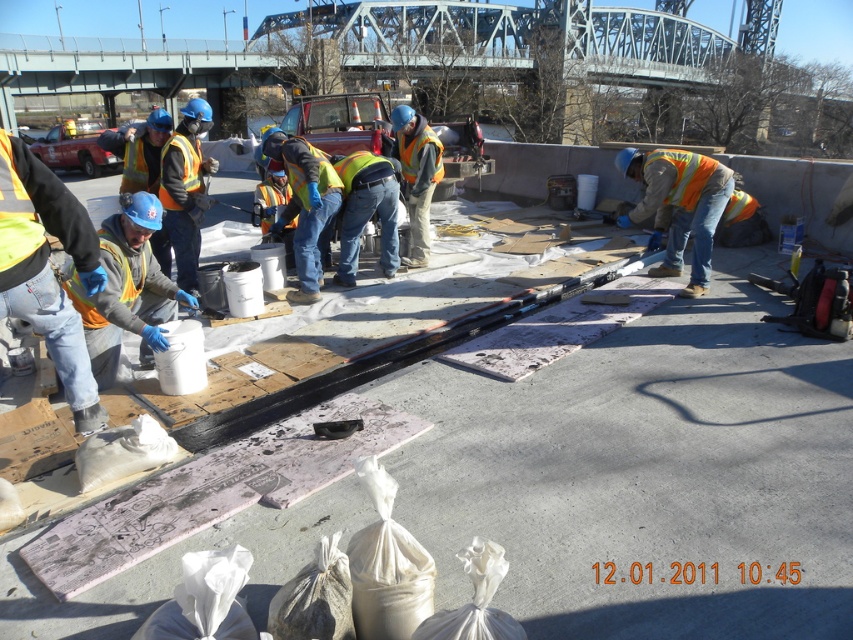
Question: Is matte gray bucket at lower left closer to camera compared to orange reflective vest at right?

Choices:
 (A) yes
 (B) no

Answer: (A)

Question: Which of these objects is positioned closest to the orange reflective vest at center?

Choices:
 (A) orange reflective vest at right
 (B) matte gray bucket at lower left

Answer: (A)

Question: Which point is farther to the camera?

Choices:
 (A) matte gray bucket at lower left
 (B) orange reflective vest at right

Answer: (B)

Question: Is matte gray bucket at lower left bigger than orange reflective vest at center?

Choices:
 (A) no
 (B) yes

Answer: (B)

Question: Does matte gray bucket at lower left come behind orange reflective vest at right?

Choices:
 (A) no
 (B) yes

Answer: (A)

Question: Which point is closer to the camera?

Choices:
 (A) orange reflective vest at center
 (B) matte gray bucket at lower left

Answer: (B)